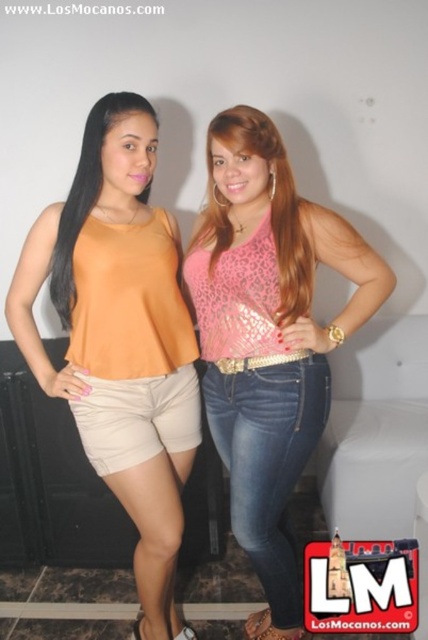
You are a photographer setting up a shoot. You need to ensure that the matte orange tank top at left and the pink sequined top at center are visible in the frame. Based on their positions, which top should you focus on first to capture both in the shot?

The matte orange tank top at left is above the pink sequined top at center, so focusing on the matte orange tank top at left first will ensure both tops are in the frame.